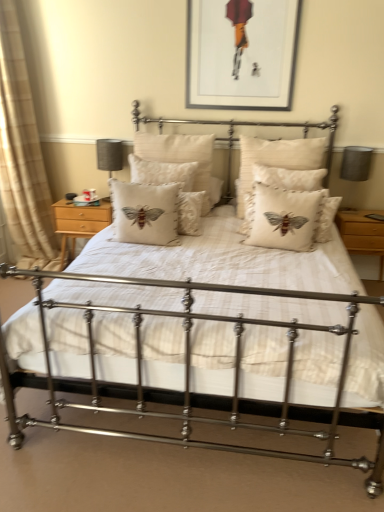
Question: Which direction should I rotate to look at creamy linen cushion with embroidered bee at center, the fourth pillow viewed from the left?

Choices:
 (A) left
 (B) right

Answer: (B)

Question: Is beige linen cushion with embroidered moth at center, the second pillow from the left, a part of matte gray lampshade at left, positioned as the first table lamp in left-to-right order?

Choices:
 (A) yes
 (B) no

Answer: (B)

Question: Is the position of matte gray lampshade at left, positioned as the first table lamp in left-to-right order, more distant than that of beige linen cushion with embroidered moth at center, the third pillow in the right-to-left sequence?

Choices:
 (A) yes
 (B) no

Answer: (A)

Question: Does matte gray lampshade at left, the second table lamp when ordered from right to left, have a larger size compared to beige linen cushion with embroidered moth at center, the third pillow in the right-to-left sequence?

Choices:
 (A) yes
 (B) no

Answer: (B)

Question: Are matte gray lampshade at left, positioned as the first table lamp in left-to-right order, and beige linen cushion with embroidered moth at center, the third pillow in the right-to-left sequence, located far from each other?

Choices:
 (A) yes
 (B) no

Answer: (B)

Question: Does matte gray lampshade at left, positioned as the first table lamp in left-to-right order, have a lesser height compared to beige linen cushion with embroidered moth at center, the third pillow in the right-to-left sequence?

Choices:
 (A) no
 (B) yes

Answer: (B)

Question: Does matte gray lampshade at left, the second table lamp when ordered from right to left, lie in front of beige linen cushion with embroidered moth at center, the second pillow from the left?

Choices:
 (A) yes
 (B) no

Answer: (B)

Question: From the image's perspective, would you say matte black picture frame at upper center is positioned over matte gray lampshade at left, positioned as the first table lamp in left-to-right order?

Choices:
 (A) yes
 (B) no

Answer: (A)

Question: Is matte black picture frame at upper center taller than matte gray lampshade at left, positioned as the first table lamp in left-to-right order?

Choices:
 (A) no
 (B) yes

Answer: (B)

Question: Is the position of matte black picture frame at upper center less distant than that of matte gray lampshade at left, the second table lamp when ordered from right to left?

Choices:
 (A) yes
 (B) no

Answer: (A)

Question: Is matte black picture frame at upper center beside matte gray lampshade at left, the second table lamp when ordered from right to left?

Choices:
 (A) yes
 (B) no

Answer: (B)

Question: From a real-world perspective, does matte black picture frame at upper center stand above matte gray lampshade at left, the second table lamp when ordered from right to left?

Choices:
 (A) no
 (B) yes

Answer: (B)

Question: Is matte black picture frame at upper center positioned behind matte gray lampshade at left, the second table lamp when ordered from right to left?

Choices:
 (A) no
 (B) yes

Answer: (A)

Question: Is beige linen cushion with embroidered moth at center, the third pillow in the right-to-left sequence, with matte gray lampshade at right, the 1th table lamp in the right-to-left sequence?

Choices:
 (A) no
 (B) yes

Answer: (A)